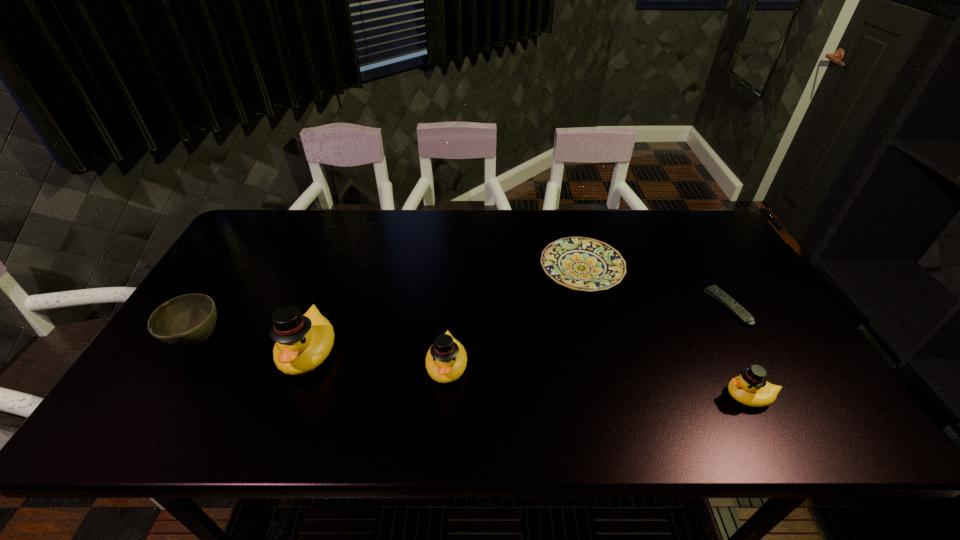
Where is `vacant space located 0.280m on the front-facing side of the shortest duck`? Image resolution: width=960 pixels, height=540 pixels. vacant space located 0.280m on the front-facing side of the shortest duck is located at coordinates (601, 396).

Find the location of a particular element. vacant space positioned 0.230m on the front-facing side of the shortest duck is located at coordinates (623, 396).

Find the location of a particular element. The height and width of the screenshot is (540, 960). free spot located 0.390m on the back of the remote control is located at coordinates (673, 213).

You are a GUI agent. You are given a task and a screenshot of the screen. Output one action in this format:
    pyautogui.click(x=<x>, y=<y>)
    Task: Click on the free space located 0.180m on the back of the bowl
    
    Given the screenshot: What is the action you would take?
    pyautogui.click(x=238, y=275)

This screenshot has width=960, height=540. I want to click on blank space located 0.300m on the right of the fifth tallest object, so click(x=722, y=268).

The height and width of the screenshot is (540, 960). Find the location of `object at the far edge`. object at the far edge is located at coordinates (579, 263).

Locate an element on the screen. The image size is (960, 540). object at the left edge is located at coordinates (188, 320).

In order to click on duck that is at the right edge in this screenshot , I will do `click(750, 388)`.

Identify the location of remote control present at the right edge. This screenshot has height=540, width=960. (718, 294).

At what (x,y) coordinates should I click in order to perform the action: click on object at the near right corner. Please return your answer as a coordinate pair (x, y). Image resolution: width=960 pixels, height=540 pixels. Looking at the image, I should click on (750, 388).